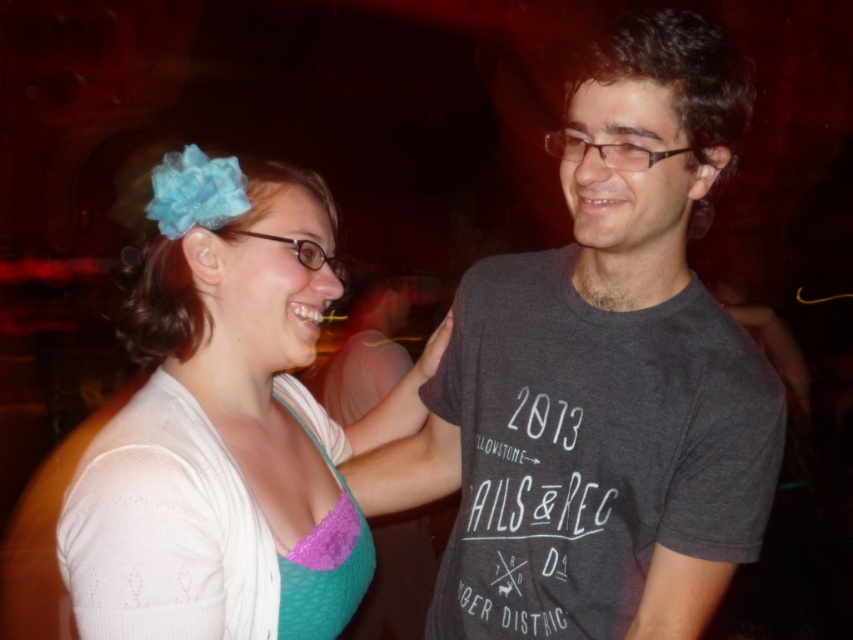
What is the relationship between the size of the matte blue fabric flower at upper left and the purple lace bikini top at left?

The matte blue fabric flower at upper left is larger in size than the purple lace bikini top at left.